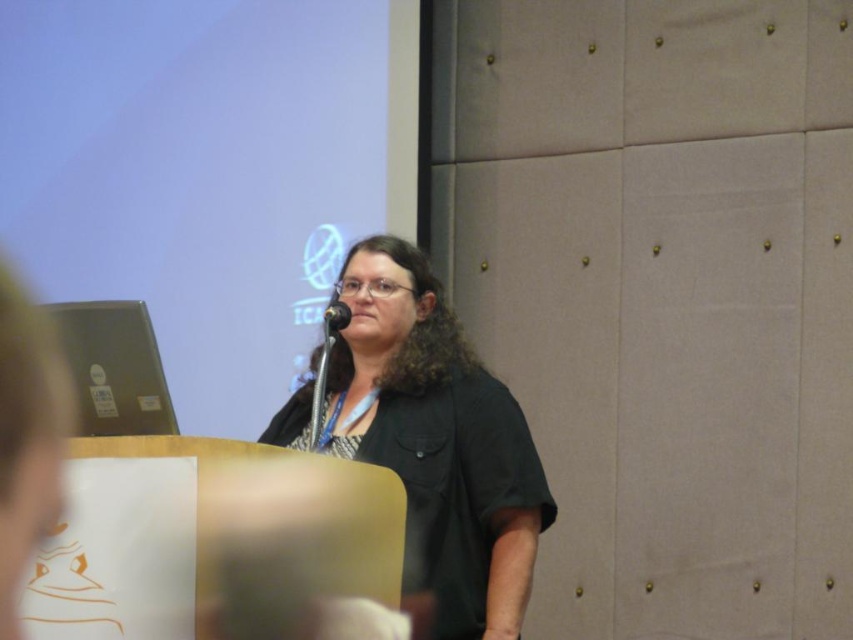
You are a photographer positioned at the front row of the conference. You want to take a closeup shot of the speaker. Where should you focus your camera to capture the black matte shirt at center?

The black matte shirt at center is located at point (437, 442), so you should focus your camera at those coordinates to capture it.

You are organizing a presentation and need to move the black metallic microphone at center closer to the audience. However, there is a satin silver laptop at left in the way. Can you move the microphone without moving the laptop?

The satin silver laptop at left is in front of the black metallic microphone at center, so you cannot move the microphone closer to the audience without moving the laptop first.

You are a photographer positioned behind the podium. You want to take a closeup shot of the black metallic microphone at center without the black matte shirt at center being in the frame. Is this possible given their distance?

The black matte shirt at center is 33.86 centimeters away from the black metallic microphone at center. Since the shirt and microphone are separated by over 30 centimeters, it is possible to frame the shot so that only the microphone is visible while excluding the shirt.